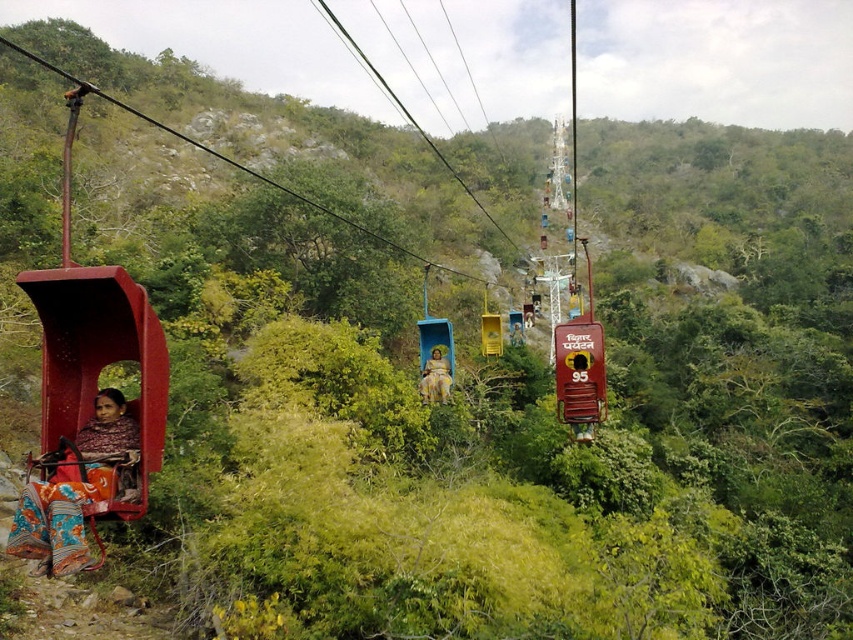
You are planning to take a photo of the patterned fabric person at left and the yellow matte lift at center. Which object should you zoom in more on to ensure both are in frame and clearly visible?

Since the patterned fabric person at left is narrower than the yellow matte lift at center, you should zoom in more on the patterned fabric person at left to ensure both fit within the frame and are visible.

You are standing at the starting point of the cable car route and see two points marked in the image. Which point is closer to you, point [132,433] or point [491,330]?

Point [132,433] is in front of point [491,330], so it is closer to you.